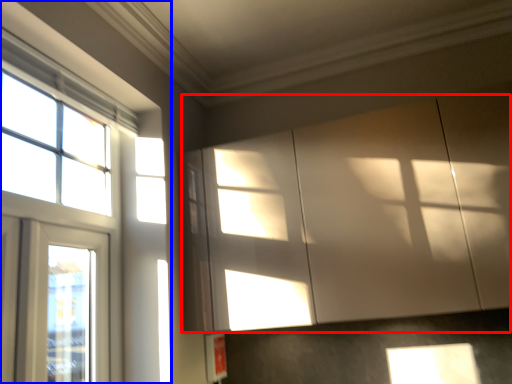
Question: Which object appears farthest to the camera in this image, cabinetry (highlighted by a red box) or window (highlighted by a blue box)?

Choices:
 (A) cabinetry
 (B) window

Answer: (A)